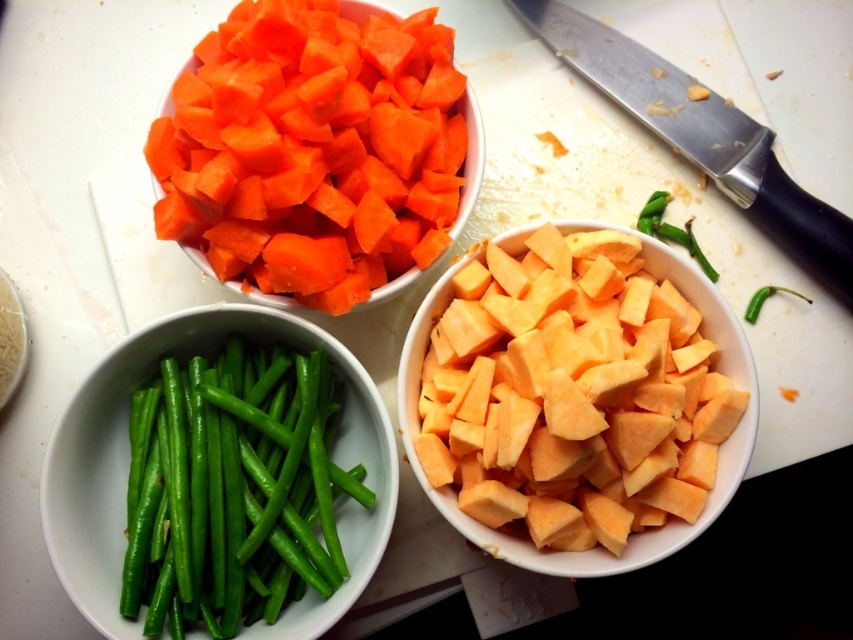
Question: Among these objects, which one is farthest from the camera?

Choices:
 (A) silver metallic knife at upper right
 (B) orange matte carrot at upper left
 (C) orange matte sweet potato at center
 (D) green smooth skin pepper at upper right

Answer: (D)

Question: Is orange matte sweet potato at center positioned at the back of orange matte carrot at upper left?

Choices:
 (A) yes
 (B) no

Answer: (B)

Question: Which point appears closest to the camera in this image?

Choices:
 (A) (773, 228)
 (B) (229, 484)
 (C) (801, 296)
 (D) (421, 104)

Answer: (B)

Question: In this image, where is orange matte carrot at upper left located relative to green smooth skin pepper at upper right?

Choices:
 (A) above
 (B) below

Answer: (A)

Question: Can you confirm if orange matte sweet potato at center is positioned to the right of green smooth skin pepper at upper right?

Choices:
 (A) yes
 (B) no

Answer: (B)

Question: Among these points, which one is nearest to the camera?

Choices:
 (A) (525, 541)
 (B) (328, 483)
 (C) (798, 230)
 (D) (213, 42)

Answer: (A)